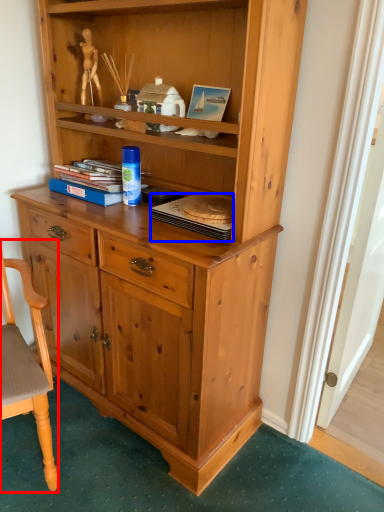
Question: Among these objects, which one is nearest to the camera, chair (highlighted by a red box) or book (highlighted by a blue box)?

Choices:
 (A) chair
 (B) book

Answer: (A)